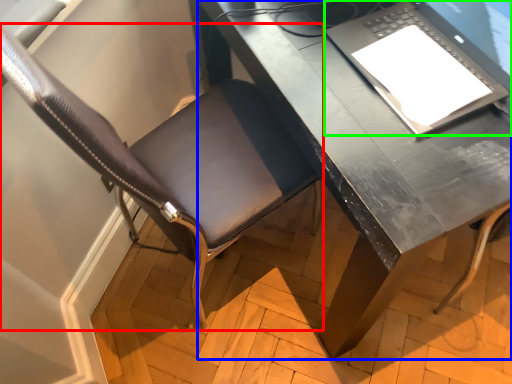
Question: Based on their relative distances, which object is nearer to chair (highlighted by a red box)? Choose from desk (highlighted by a blue box) and laptop (highlighted by a green box).

Choices:
 (A) desk
 (B) laptop

Answer: (A)